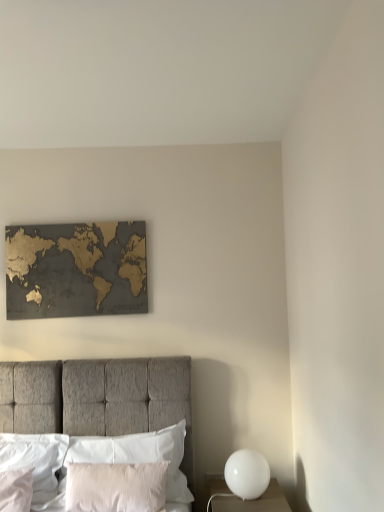
Question: Is textured gray bed at center facing away from silky white pillow at center, the 1th pillow in the right-to-left sequence?

Choices:
 (A) yes
 (B) no

Answer: (A)

Question: Is textured gray bed at center taller than silky white pillow at center, the 4th pillow when ordered from left to right?

Choices:
 (A) yes
 (B) no

Answer: (A)

Question: Does textured gray bed at center have a smaller size compared to silky white pillow at center, the 4th pillow when ordered from left to right?

Choices:
 (A) no
 (B) yes

Answer: (A)

Question: Is textured gray bed at center behind silky white pillow at center, the 4th pillow when ordered from left to right?

Choices:
 (A) yes
 (B) no

Answer: (B)

Question: Does textured gray bed at center lie in front of silky white pillow at center, the 4th pillow when ordered from left to right?

Choices:
 (A) no
 (B) yes

Answer: (B)

Question: Based on their sizes in the image, would you say white glossy sphere at lower right is bigger or smaller than textured gray bed at center?

Choices:
 (A) small
 (B) big

Answer: (A)

Question: Is point (x=249, y=504) closer or farther from the camera than point (x=145, y=428)?

Choices:
 (A) farther
 (B) closer

Answer: (B)

Question: From a real-world perspective, relative to textured gray bed at center, is white glossy sphere at lower right vertically above or below?

Choices:
 (A) below
 (B) above

Answer: (A)

Question: Considering the positions of white glossy sphere at lower right and textured gray bed at center in the image, is white glossy sphere at lower right taller or shorter than textured gray bed at center?

Choices:
 (A) short
 (B) tall

Answer: (A)

Question: Based on their positions, is silky white pillow at center, the 4th pillow when ordered from left to right, located to the left or right of textured gray bed at center?

Choices:
 (A) right
 (B) left

Answer: (A)

Question: Do you think silky white pillow at center, the 1th pillow in the right-to-left sequence, is within textured gray bed at center, or outside of it?

Choices:
 (A) inside
 (B) outside

Answer: (A)

Question: Is silky white pillow at center, the 1th pillow in the right-to-left sequence, wider or thinner than textured gray bed at center?

Choices:
 (A) thin
 (B) wide

Answer: (A)

Question: From the image's perspective, is silky white pillow at center, the 4th pillow when ordered from left to right, located above or below textured gray bed at center?

Choices:
 (A) below
 (B) above

Answer: (A)

Question: Looking at their shapes, would you say pink velvet pillow at lower center, arranged as the second pillow when viewed from the right, is wider or thinner than white glossy sphere at lower right?

Choices:
 (A) thin
 (B) wide

Answer: (A)

Question: From a real-world perspective, is pink velvet pillow at lower center, which is the 3th pillow from left to right, physically located above or below white glossy sphere at lower right?

Choices:
 (A) above
 (B) below

Answer: (B)